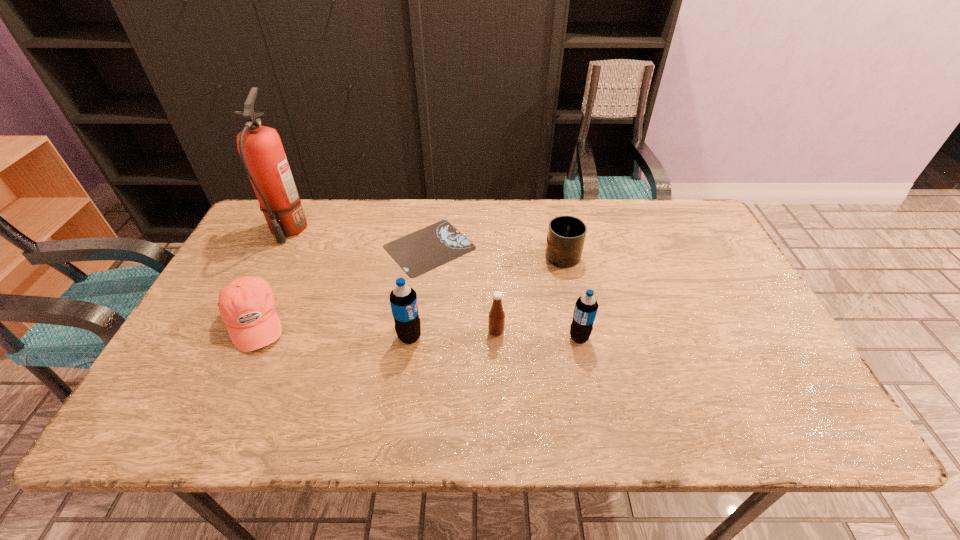
Where is `the third closest object to the shorter soda bottle`? This screenshot has width=960, height=540. the third closest object to the shorter soda bottle is located at coordinates (419, 252).

What are the coordinates of `free spot that satisfies the following two spatial constraints: 1. on the back side of the second tallest object; 2. on the left side of the Tabasco sauce` in the screenshot? It's located at (411, 332).

Find the location of a particular element. Image resolution: width=960 pixels, height=540 pixels. vacant space that satisfies the following two spatial constraints: 1. on the nozzle of the sixth shortest object; 2. on the right side of the tallest object is located at coordinates (234, 336).

At what (x,y) coordinates should I click in order to perform the action: click on vacant point that satisfies the following two spatial constraints: 1. on the back side of the second tallest object; 2. on the right side of the third object from right to left. Please return your answer as a coordinate pair (x, y). The image size is (960, 540). Looking at the image, I should click on (411, 332).

Find the location of a particular element. vacant space that satisfies the following two spatial constraints: 1. on the front side of the shorter soda bottle; 2. on the left side of the baseball cap is located at coordinates (246, 338).

I want to click on free space in the image that satisfies the following two spatial constraints: 1. on the nozzle of the tallest object; 2. on the right side of the Tabasco sauce, so click(x=236, y=332).

This screenshot has width=960, height=540. In order to click on free location that satisfies the following two spatial constraints: 1. on the nozzle of the fire extinguisher; 2. on the right side of the fourth tallest object in this screenshot , I will do [236, 332].